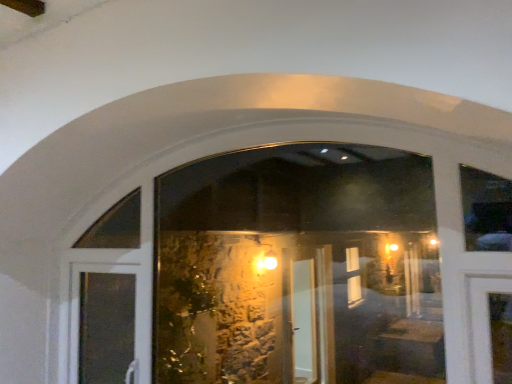
Question: Is matte glass door at lower left spatially inside transparent glass door at center, or outside of it?

Choices:
 (A) outside
 (B) inside

Answer: (B)

Question: From the image's perspective, is matte glass door at lower left positioned above or below transparent glass door at center?

Choices:
 (A) above
 (B) below

Answer: (B)

Question: In the image, is matte glass door at lower left on the left side or the right side of transparent glass door at center?

Choices:
 (A) left
 (B) right

Answer: (A)

Question: Is transparent glass door at center in front of or behind matte glass door at lower left in the image?

Choices:
 (A) front
 (B) behind

Answer: (A)

Question: Considering the positions of transparent glass door at center and matte glass door at lower left in the image, is transparent glass door at center bigger or smaller than matte glass door at lower left?

Choices:
 (A) small
 (B) big

Answer: (B)

Question: Is transparent glass door at center wider or thinner than matte glass door at lower left?

Choices:
 (A) thin
 (B) wide

Answer: (A)

Question: Considering the positions of point (283, 230) and point (98, 286), is point (283, 230) closer or farther from the camera than point (98, 286)?

Choices:
 (A) farther
 (B) closer

Answer: (A)